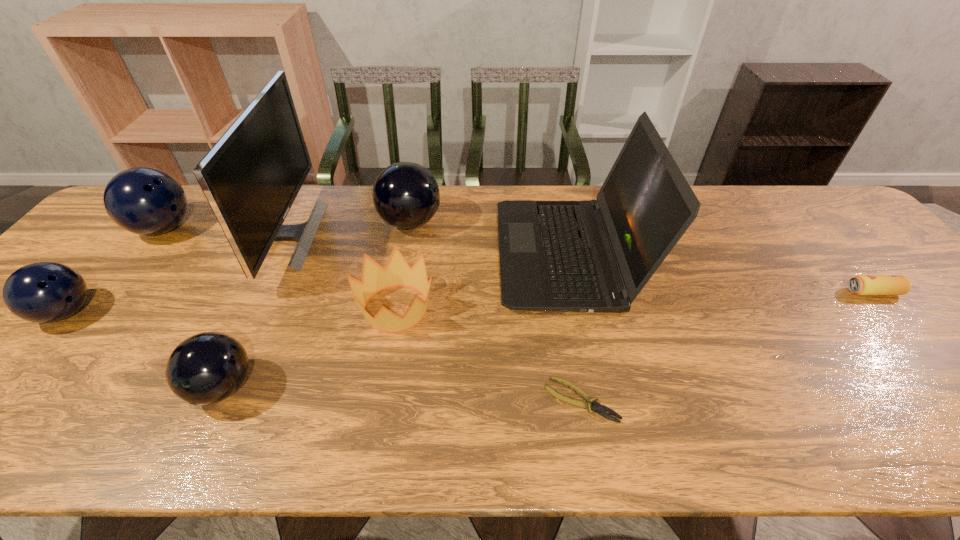
Locate an element on the screen. This screenshot has width=960, height=540. free space that is in between the third shortest object and the third farthest bowling ball is located at coordinates (469, 302).

In order to click on object that ranks as the fifth closest to the syringe in this screenshot , I will do `click(397, 272)`.

Locate which object ranks ninth in proximity to the gray laptop_computer. Please provide its 2D coordinates. Your answer should be formatted as a tuple, i.e. [(x, y)], where the tuple contains the x and y coordinates of a point satisfying the conditions above.

[(0, 407)]

Find the location of `bowling ball that is the closest to the right black bowling ball`. bowling ball that is the closest to the right black bowling ball is located at coordinates (206, 368).

Point out which bowling ball is positioned as the second nearest to the beer can. Please provide its 2D coordinates. Your answer should be formatted as a tuple, i.e. [(x, y)], where the tuple contains the x and y coordinates of a point satisfying the conditions above.

[(206, 368)]

At what (x,y) coordinates should I click in order to perform the action: click on free location that satisfies the following two spatial constraints: 1. on the screen side of the monitor; 2. on the right side of the beer can. Please return your answer as a coordinate pair (x, y). The width and height of the screenshot is (960, 540). Looking at the image, I should click on (260, 292).